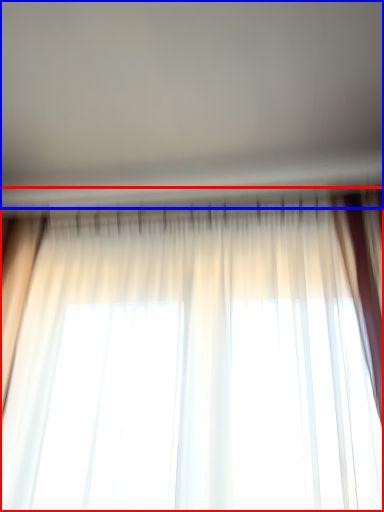
Question: Which of the following is the closest to the observer, curtain (highlighted by a red box) or backdrop (highlighted by a blue box)?

Choices:
 (A) curtain
 (B) backdrop

Answer: (B)